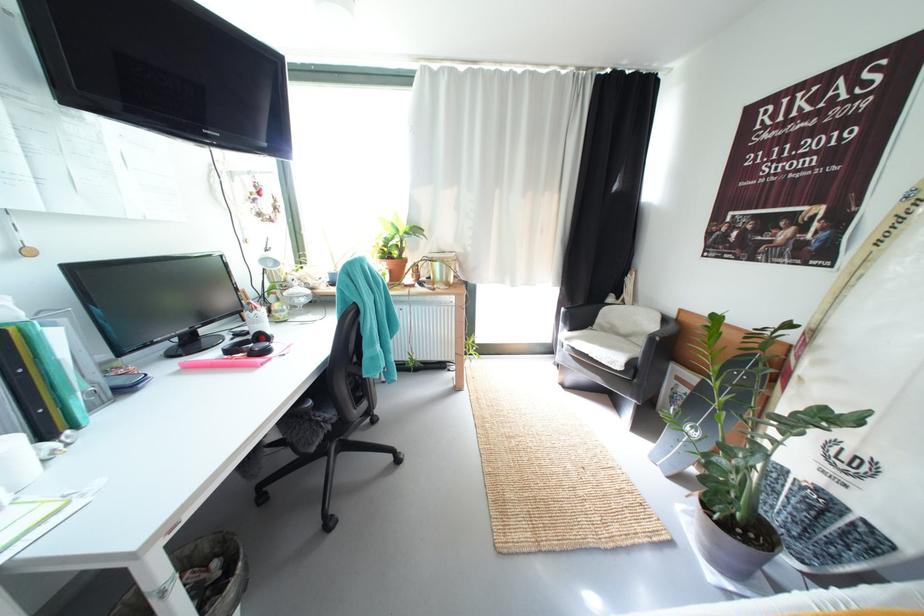
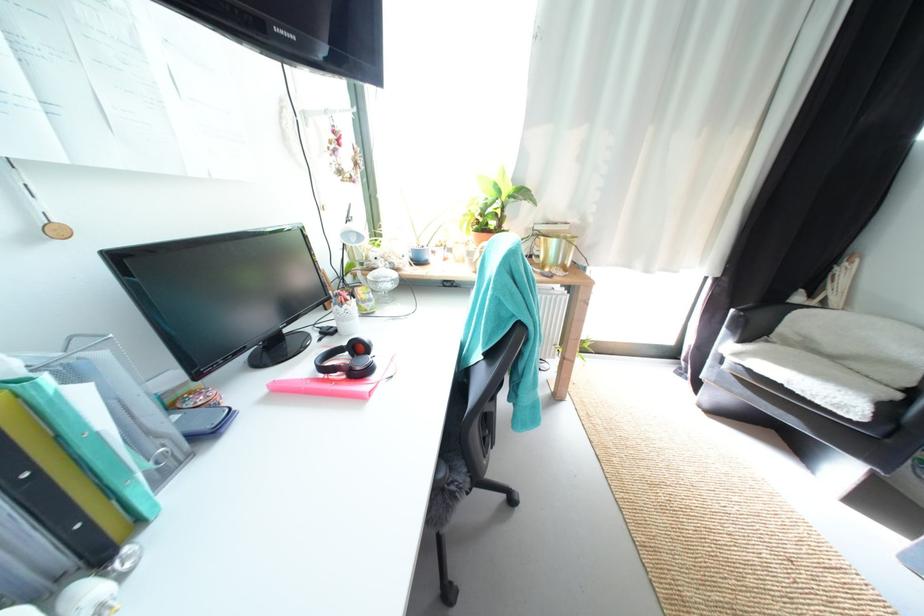
The point at [260,312] is marked in the first image. Where is the corresponding point in the second image?

(348, 306)